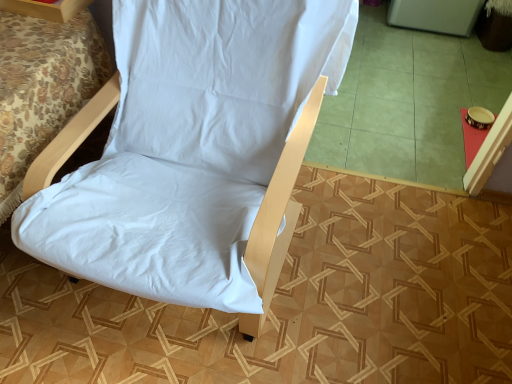
Question: From a real-world perspective, is white fabric bed at lower left above or below green tile at center?

Choices:
 (A) below
 (B) above

Answer: (B)

Question: From the image's perspective, is white fabric bed at lower left located above or below green tile at center?

Choices:
 (A) above
 (B) below

Answer: (B)

Question: Which object is positioned closest to the green tile at center?

Choices:
 (A) white fabric bed at lower left
 (B) white fabric chair at upper left
 (C) white fabric chair at center

Answer: (C)

Question: Based on their relative distances, which object is nearer to the green tile at center?

Choices:
 (A) white fabric bed at lower left
 (B) white fabric chair at upper left
 (C) white fabric chair at center

Answer: (C)